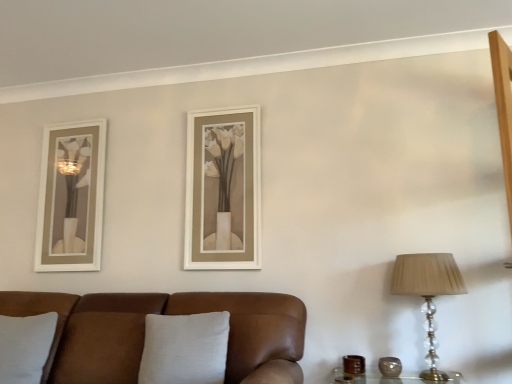
Question: Can you confirm if gray fabric pillow at lower left, marked as the 1th pillow in a left-to-right arrangement, is thinner than brown leather couch at lower left?

Choices:
 (A) no
 (B) yes

Answer: (B)

Question: From a real-world perspective, does gray fabric pillow at lower left, the second pillow viewed from the right, stand above brown leather couch at lower left?

Choices:
 (A) yes
 (B) no

Answer: (A)

Question: From the image's perspective, is gray fabric pillow at lower left, the second pillow viewed from the right, over brown leather couch at lower left?

Choices:
 (A) no
 (B) yes

Answer: (B)

Question: Does gray fabric pillow at lower left, the second pillow viewed from the right, have a lesser height compared to brown leather couch at lower left?

Choices:
 (A) no
 (B) yes

Answer: (B)

Question: Is gray fabric pillow at lower left, marked as the 1th pillow in a left-to-right arrangement, oriented towards brown leather couch at lower left?

Choices:
 (A) yes
 (B) no

Answer: (A)

Question: From the image's perspective, is brown textured vase at right, the second candle holder in the left-to-right sequence, positioned above or below translucent crystal table lamp at right?

Choices:
 (A) above
 (B) below

Answer: (B)

Question: In the image, is brown textured vase at right, marked as the first candle holder in a right-to-left arrangement, on the left side or the right side of translucent crystal table lamp at right?

Choices:
 (A) right
 (B) left

Answer: (B)

Question: Does point (386, 365) appear closer or farther from the camera than point (442, 274)?

Choices:
 (A) farther
 (B) closer

Answer: (A)

Question: From their relative heights in the image, would you say brown textured vase at right, marked as the first candle holder in a right-to-left arrangement, is taller or shorter than translucent crystal table lamp at right?

Choices:
 (A) tall
 (B) short

Answer: (B)

Question: Is gray fabric pillow at lower left, marked as the 1th pillow in a left-to-right arrangement, inside or outside of brown leather candle holder at lower right, acting as the 1th candle holder starting from the left?

Choices:
 (A) inside
 (B) outside

Answer: (B)

Question: Considering the positions of gray fabric pillow at lower left, marked as the 1th pillow in a left-to-right arrangement, and brown leather candle holder at lower right, positioned as the 2th candle holder in right-to-left order, in the image, is gray fabric pillow at lower left, marked as the 1th pillow in a left-to-right arrangement, bigger or smaller than brown leather candle holder at lower right, positioned as the 2th candle holder in right-to-left order,?

Choices:
 (A) big
 (B) small

Answer: (A)

Question: In the image, is gray fabric pillow at lower left, marked as the 1th pillow in a left-to-right arrangement, positioned in front of or behind brown leather candle holder at lower right, acting as the 1th candle holder starting from the left?

Choices:
 (A) front
 (B) behind

Answer: (A)

Question: From a real-world perspective, is gray fabric pillow at lower left, marked as the 1th pillow in a left-to-right arrangement, above or below brown leather candle holder at lower right, acting as the 1th candle holder starting from the left?

Choices:
 (A) above
 (B) below

Answer: (A)

Question: From their relative heights in the image, would you say white linen pillow at center, positioned as the 1th pillow in right-to-left order, is taller or shorter than translucent crystal table lamp at right?

Choices:
 (A) tall
 (B) short

Answer: (B)

Question: From a real-world perspective, is white linen pillow at center, positioned as the 1th pillow in right-to-left order, above or below translucent crystal table lamp at right?

Choices:
 (A) below
 (B) above

Answer: (A)